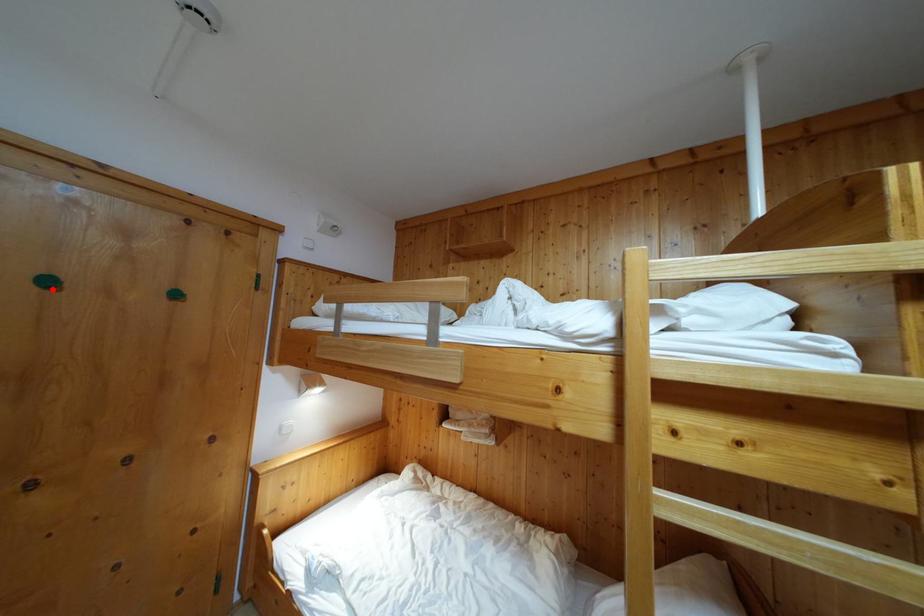
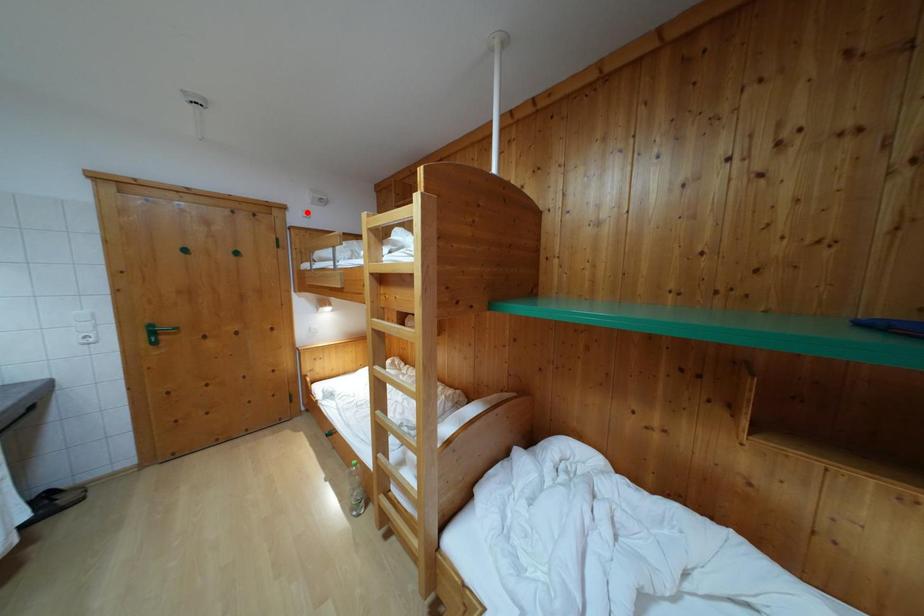
Looking at this image, I am providing you with two images of the same scene from different viewpoints. A red point is marked on the first image and another point is marked on the second image. Is the marked point in image1 the same physical position as the marked point in image2?

No